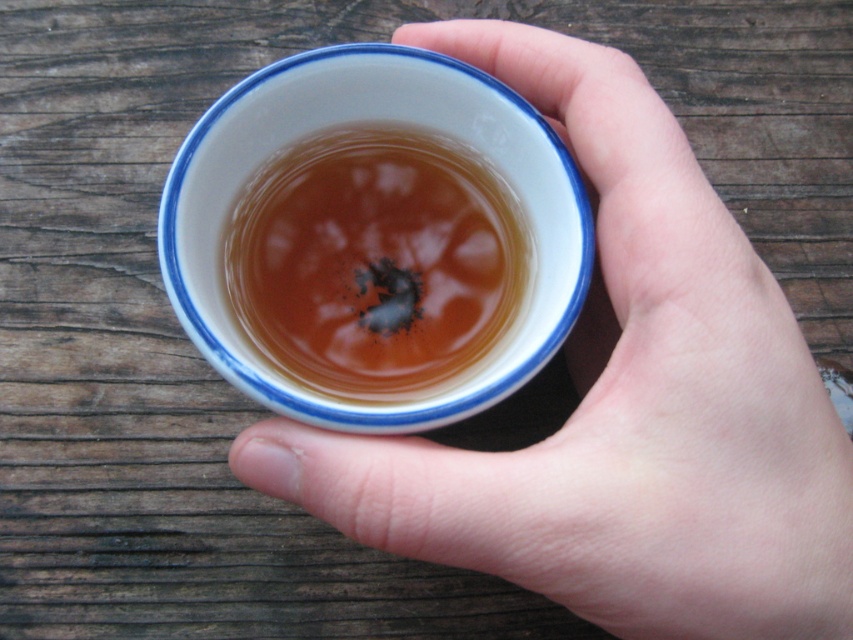
Question: Is white glossy cup at center positioned at the back of translucent amber liquid at center?

Choices:
 (A) yes
 (B) no

Answer: (B)

Question: Considering the relative positions of white glossy cup at center and translucent amber liquid at center in the image provided, where is white glossy cup at center located with respect to translucent amber liquid at center?

Choices:
 (A) left
 (B) right

Answer: (B)

Question: Can you confirm if white glossy cup at center is positioned below translucent amber liquid at center?

Choices:
 (A) no
 (B) yes

Answer: (B)

Question: Which object is farther from the camera taking this photo?

Choices:
 (A) translucent amber liquid at center
 (B) white glossy cup at center

Answer: (A)